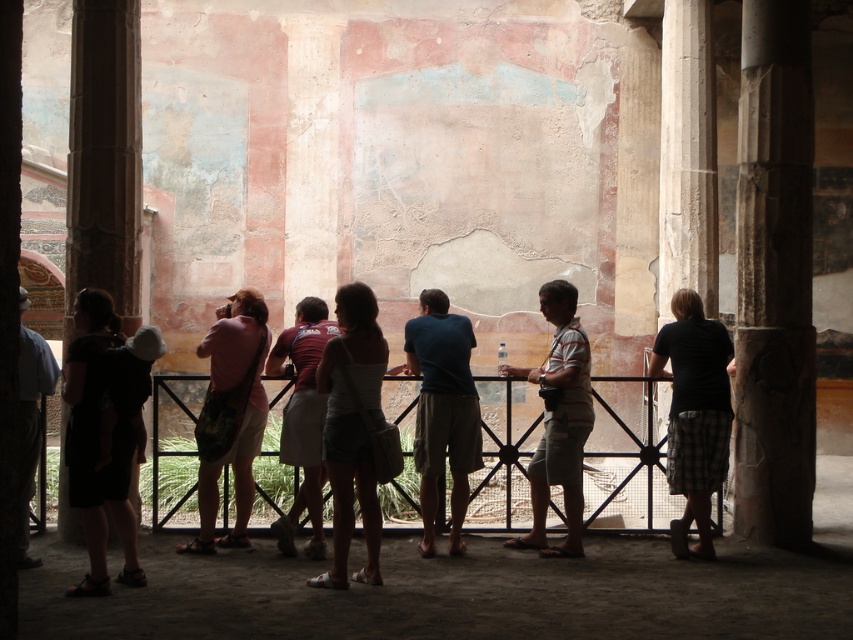
You are a tour guide standing in front of the ancient wall with faded frescoes. You need to point out two specific points on the wall to your group. The first point is at coordinate point (699, 362) and the second is at point (453, 528). Which of these two points is closer to you?

The point at coordinate point (699, 362) is closer to you than the point at (453, 528).

You are a tour guide explaining the ancient wall to visitors. You point to two points on the wall, one at coordinates point (740, 108) and the other at point (131, 205). Which point is closer to the visitors standing behind the metal railing?

Point (131, 205) is closer to the visitors because it is less further to the viewer than point (740, 108), which is positioned further away.

You are a tour guide at the historical site. You need to ensure that all visitors are maintaining a safe distance from the ancient wall. The safety guideline states that visitors must stay at least 1.5 meters away from the wall. Currently, you see the black cotton shirt at right and the blue cotton shirt at center. Which visitor is closer to the wall?

The blue cotton shirt at center is closer to the wall because the black cotton shirt at right has a larger size compared to the blue cotton shirt at center, implying it is farther away to appear smaller.